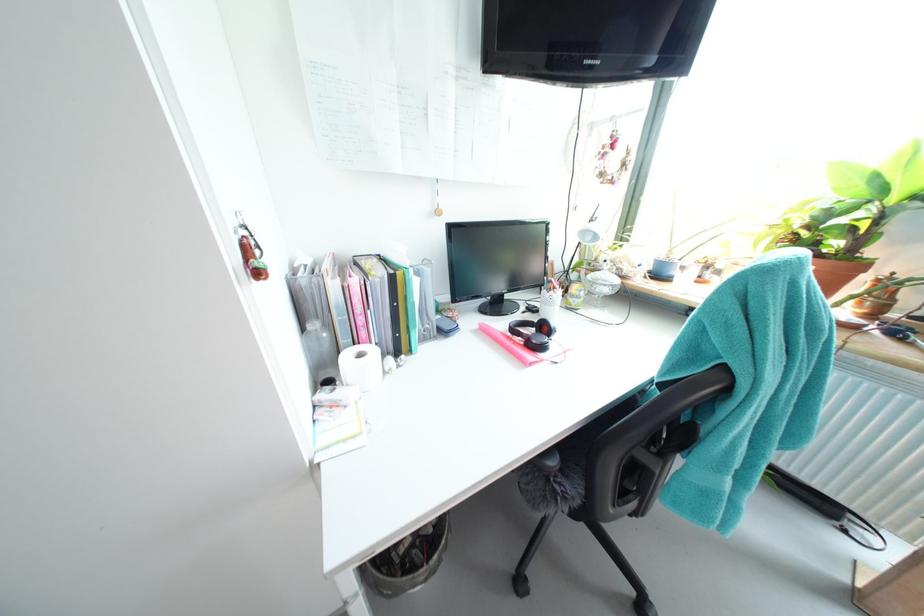
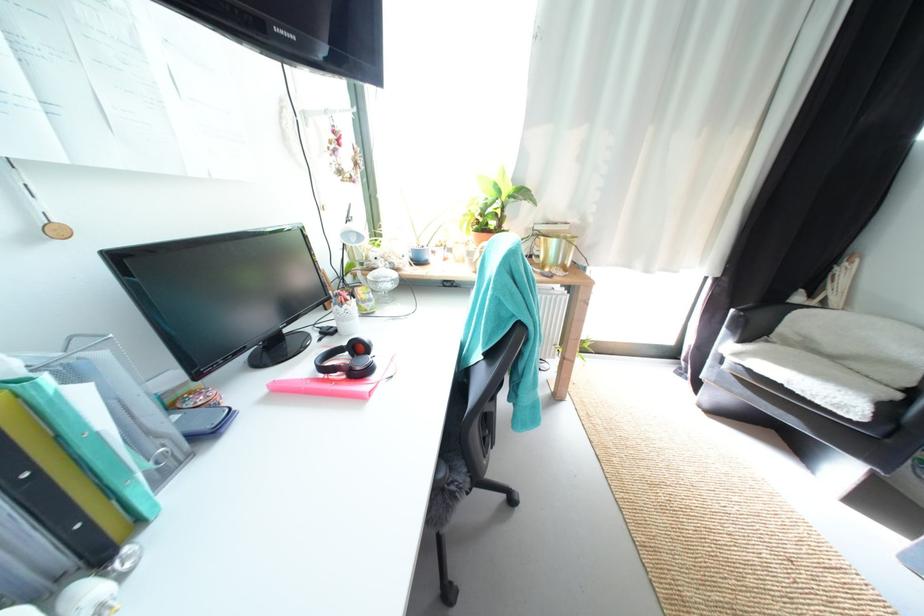
Question: How did the camera likely rotate?

Choices:
 (A) Left
 (B) Right
 (C) Up
 (D) Down

Answer: (B)